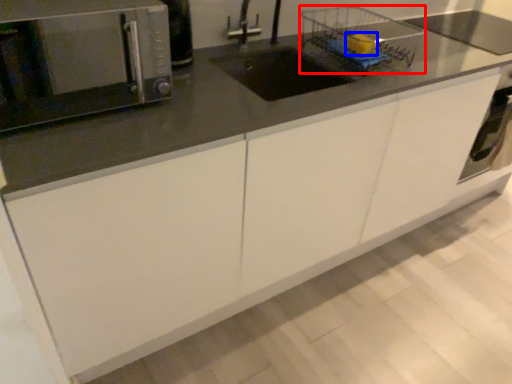
Question: Which point is closer to the camera, basket (highlighted by a red box) or food (highlighted by a blue box)?

Choices:
 (A) basket
 (B) food

Answer: (A)